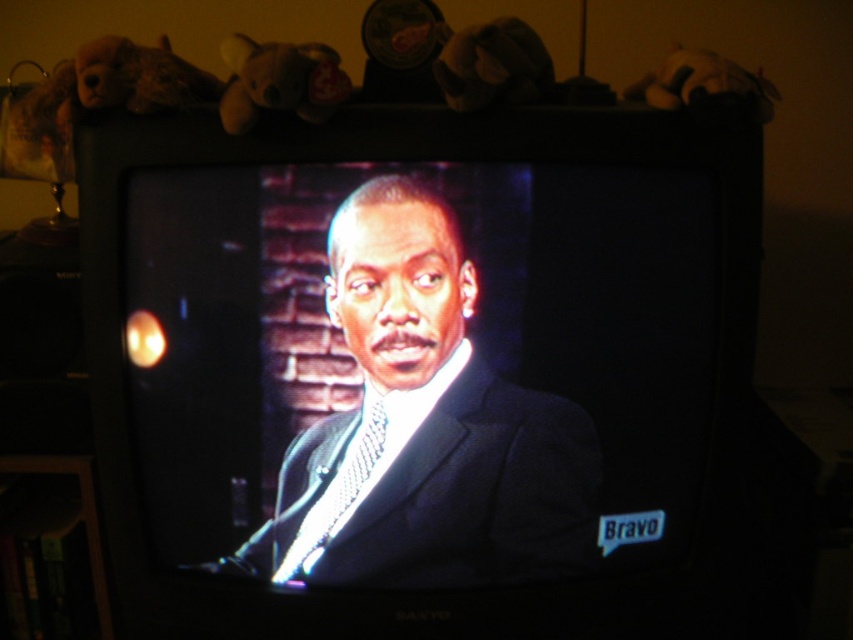
You are a costume designer working on a new project. You need to determine the distance between the matte black suit at center and the shiny silver tie at center in the image. Can you provide the exact measurement?

The matte black suit at center is 2.64 inches away from the shiny silver tie at center according to the description.

You are a costume designer observing the man on the CRT television. You need to determine the arrangement of his clothing items. Which clothing item, the matte black suit at center or the shiny silver tie at center, is positioned higher on his body?

The matte black suit at center is located above the shiny silver tie at center, so the matte black suit at center is positioned higher on his body.

You are a costume designer analyzing the image of a man in formal attire on a CRT television. You need to determine the spatial relationship between the matte black suit at center and the shiny silver tie at center. Which object is closer to the viewer?

The matte black suit at center is closer to the viewer than the shiny silver tie at center.